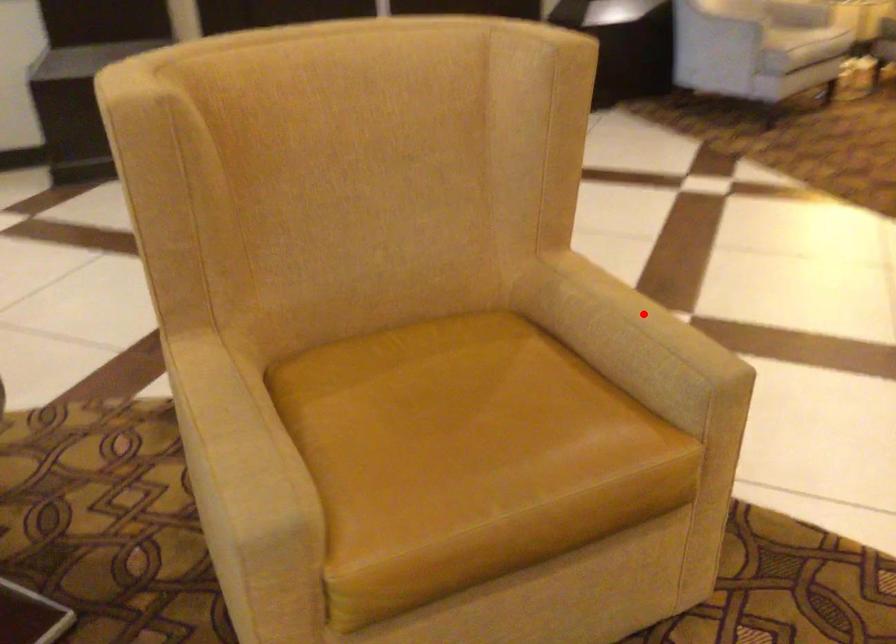
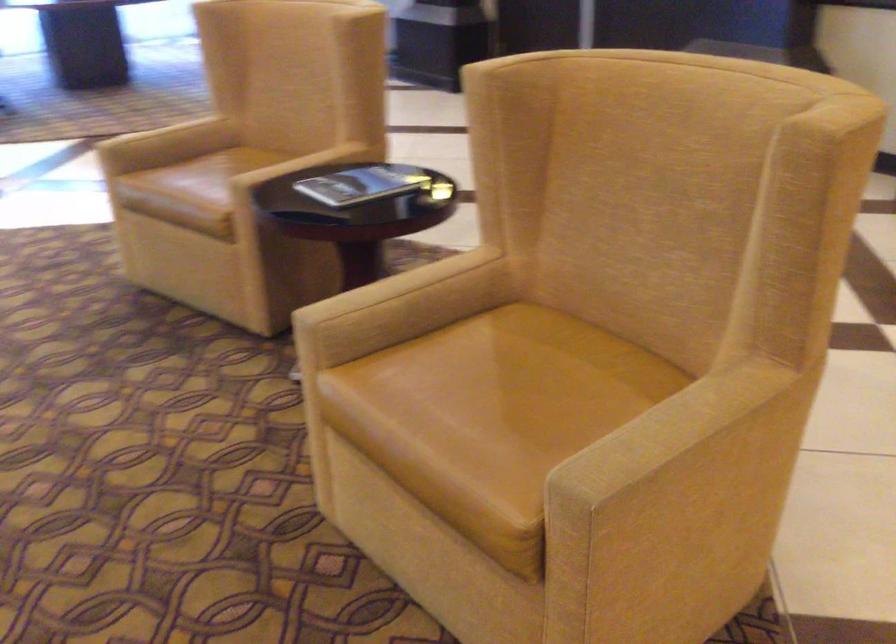
Question: I am providing you with two images of the same scene from different viewpoints. Given a red point in image1, look at the same physical point in image2. Is it:

Choices:
 (A) Closer to the viewpoint
 (B) Farther from the viewpoint

Answer: (A)